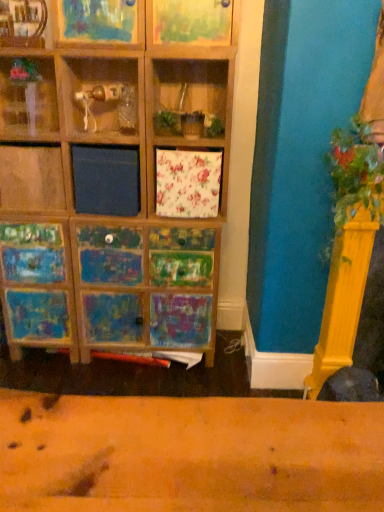
What do you see at coordinates (28, 98) in the screenshot? This screenshot has width=384, height=512. I see `clear glass vase at upper left, the first shelf viewed from the left` at bounding box center [28, 98].

Based on the photo, how much space does clear glass vase at upper left, arranged as the third shelf when viewed from the right, occupy vertically?

The height of clear glass vase at upper left, arranged as the third shelf when viewed from the right, is 13.66 inches.

Measure the distance between wooden shelf at upper left, arranged as the second shelf when viewed from the right, and camera.

wooden shelf at upper left, arranged as the second shelf when viewed from the right, and camera are 6.30 feet apart.

Describe the element at coordinates (354, 177) in the screenshot. The width and height of the screenshot is (384, 512). I see `green leafy plant at right` at that location.

In order to click on green leafy plant at right in this screenshot , I will do `click(354, 177)`.

Find the location of a particular element. The height and width of the screenshot is (512, 384). clear glass vase at upper left, the first shelf viewed from the left is located at coordinates (28, 98).

From a real-world perspective, is green leafy plant at right positioned under wooden shelf at upper left, arranged as the second shelf when viewed from the right, based on gravity?

Yes, from a real-world perspective, green leafy plant at right is below wooden shelf at upper left, arranged as the second shelf when viewed from the right.

Which of these two, green leafy plant at right or wooden shelf at upper left, arranged as the second shelf when viewed from the right, stands shorter?

wooden shelf at upper left, arranged as the second shelf when viewed from the right, is shorter.

Between green leafy plant at right and wooden shelf at upper left, arranged as the second shelf when viewed from the right, which one has smaller width?

With smaller width is wooden shelf at upper left, arranged as the second shelf when viewed from the right.

From the image's perspective, is green leafy plant at right over clear glass vase at upper left, the first shelf viewed from the left?

No.

How many degrees apart are the facing directions of green leafy plant at right and clear glass vase at upper left, the first shelf viewed from the left?

green leafy plant at right and clear glass vase at upper left, the first shelf viewed from the left, are facing 4.82 degrees away from each other.

From their relative heights in the image, would you say green leafy plant at right is taller or shorter than clear glass vase at upper left, arranged as the third shelf when viewed from the right?

green leafy plant at right is taller than clear glass vase at upper left, arranged as the third shelf when viewed from the right.

Which shelf is the 1st one when counting from the left side of the wooden frame at upper center, arranged as the first shelf when viewed from the right? Please provide its 2D coordinates.

[(23, 23)]

Consider the image. Is wooden frame at upper center, arranged as the first shelf when viewed from the right, inside wooden shelf at upper left, positioned as the second shelf in left-to-right order?

Definitely not — wooden frame at upper center, arranged as the first shelf when viewed from the right, is not inside wooden shelf at upper left, positioned as the second shelf in left-to-right order.

From a real-world perspective, between wooden shelf at upper left, positioned as the second shelf in left-to-right order, and wooden frame at upper center, which is the third shelf in left-to-right order, who is vertically higher?

wooden frame at upper center, which is the third shelf in left-to-right order, is physically above.

Is point (14, 19) in front of point (107, 22)?

No, (14, 19) is further to viewer.

Can you tell me how much clear glass vase at upper left, arranged as the third shelf when viewed from the right, and green leafy plant at right differ in facing direction?

The angular difference between clear glass vase at upper left, arranged as the third shelf when viewed from the right, and green leafy plant at right is 4.82 degrees.

Which point is more forward, [16,65] or [350,173]?

Positioned in front is point [350,173].

Based on the photo, is clear glass vase at upper left, arranged as the third shelf when viewed from the right, inside or outside of green leafy plant at right?

clear glass vase at upper left, arranged as the third shelf when viewed from the right, is located beyond the bounds of green leafy plant at right.

From a real-world perspective, which is physically below, clear glass vase at upper left, the first shelf viewed from the left, or green leafy plant at right?

In real-world perspective, green leafy plant at right is lower.

How far apart are wooden frame at upper center, arranged as the first shelf when viewed from the right, and clear glass vase at upper left, the first shelf viewed from the left?

wooden frame at upper center, arranged as the first shelf when viewed from the right, and clear glass vase at upper left, the first shelf viewed from the left, are 14.05 inches apart.

From the image's perspective, which object appears higher, wooden frame at upper center, which is the third shelf in left-to-right order, or clear glass vase at upper left, arranged as the third shelf when viewed from the right?

wooden frame at upper center, which is the third shelf in left-to-right order, appears higher in the image.

In the image, is wooden frame at upper center, arranged as the first shelf when viewed from the right, on the left side or the right side of clear glass vase at upper left, the first shelf viewed from the left?

From the image, it's evident that wooden frame at upper center, arranged as the first shelf when viewed from the right, is to the right of clear glass vase at upper left, the first shelf viewed from the left.

From a real-world perspective, does wooden frame at upper center, which is the third shelf in left-to-right order, sit lower than clear glass vase at upper left, arranged as the third shelf when viewed from the right?

Actually, wooden frame at upper center, which is the third shelf in left-to-right order, is physically above clear glass vase at upper left, arranged as the third shelf when viewed from the right, in the real world.

Can you confirm if wooden frame at upper center, which is the third shelf in left-to-right order, is positioned to the left of green leafy plant at right?

Yes, wooden frame at upper center, which is the third shelf in left-to-right order, is to the left of green leafy plant at right.

Which of these two, wooden frame at upper center, which is the third shelf in left-to-right order, or green leafy plant at right, stands shorter?

wooden frame at upper center, which is the third shelf in left-to-right order.

From a real-world perspective, is wooden frame at upper center, which is the third shelf in left-to-right order, below green leafy plant at right?

Incorrect, from a real-world perspective, wooden frame at upper center, which is the third shelf in left-to-right order, is higher than green leafy plant at right.

From the image's perspective, between wooden frame at upper center, which is the third shelf in left-to-right order, and green leafy plant at right, which one is located above?

From the image's view, wooden frame at upper center, which is the third shelf in left-to-right order, is above.

Considering the points (34, 39) and (335, 195), which point is in front, point (34, 39) or point (335, 195)?

Point (335, 195)

Does wooden shelf at upper left, positioned as the second shelf in left-to-right order, have a lesser height compared to green leafy plant at right?

Correct, wooden shelf at upper left, positioned as the second shelf in left-to-right order, is not as tall as green leafy plant at right.

From the green leafy plant at right, count 2nd shelfs backward and point to it. Please provide its 2D coordinates.

[(23, 23)]

Is wooden shelf at upper left, positioned as the second shelf in left-to-right order, inside the boundaries of green leafy plant at right, or outside?

wooden shelf at upper left, positioned as the second shelf in left-to-right order, cannot be found inside green leafy plant at right.

Identify the location of plant located underneath the wooden shelf at upper left, arranged as the second shelf when viewed from the right (from a real-world perspective). Image resolution: width=384 pixels, height=512 pixels. (354, 177).

Image resolution: width=384 pixels, height=512 pixels. Identify the location of plant on the right of the clear glass vase at upper left, arranged as the third shelf when viewed from the right. (354, 177).

Considering their positions, is wooden shelf at upper left, arranged as the second shelf when viewed from the right, positioned further to green leafy plant at right than clear glass vase at upper left, the first shelf viewed from the left?

Among the two, wooden shelf at upper left, arranged as the second shelf when viewed from the right, is located further to green leafy plant at right.

Which object lies nearer to the anchor point wooden shelf at upper left, positioned as the second shelf in left-to-right order, wooden frame at upper center, which is the third shelf in left-to-right order, or clear glass vase at upper left, the first shelf viewed from the left?

The object closer to wooden shelf at upper left, positioned as the second shelf in left-to-right order, is wooden frame at upper center, which is the third shelf in left-to-right order.

Looking at this image, which object lies nearer to the anchor point wooden frame at upper center, which is the third shelf in left-to-right order, clear glass vase at upper left, arranged as the third shelf when viewed from the right, or wooden shelf at upper left, arranged as the second shelf when viewed from the right?

wooden shelf at upper left, arranged as the second shelf when viewed from the right.

Based on the photo, looking at the image, which one is located closer to wooden frame at upper center, which is the third shelf in left-to-right order, green leafy plant at right or wooden shelf at upper left, arranged as the second shelf when viewed from the right?

wooden shelf at upper left, arranged as the second shelf when viewed from the right, is closer to wooden frame at upper center, which is the third shelf in left-to-right order.

When comparing their distances from green leafy plant at right, does wooden frame at upper center, which is the third shelf in left-to-right order, or wooden shelf at upper left, positioned as the second shelf in left-to-right order, seem further?

The object further to green leafy plant at right is wooden shelf at upper left, positioned as the second shelf in left-to-right order.

Looking at the image, which one is located closer to wooden shelf at upper left, arranged as the second shelf when viewed from the right, green leafy plant at right or wooden frame at upper center, arranged as the first shelf when viewed from the right?

wooden frame at upper center, arranged as the first shelf when viewed from the right.

When comparing their distances from green leafy plant at right, does wooden frame at upper center, arranged as the first shelf when viewed from the right, or clear glass vase at upper left, the first shelf viewed from the left, seem further?

Among the two, clear glass vase at upper left, the first shelf viewed from the left, is located further to green leafy plant at right.

Based on their spatial positions, is clear glass vase at upper left, the first shelf viewed from the left, or green leafy plant at right closer to wooden frame at upper center, which is the third shelf in left-to-right order?

Among the two, clear glass vase at upper left, the first shelf viewed from the left, is located nearer to wooden frame at upper center, which is the third shelf in left-to-right order.

In order to click on shelf between clear glass vase at upper left, the first shelf viewed from the left, and wooden frame at upper center, which is the third shelf in left-to-right order, from left to right in this screenshot , I will do `click(23, 23)`.

The height and width of the screenshot is (512, 384). I want to click on shelf between wooden shelf at upper left, positioned as the second shelf in left-to-right order, and green leafy plant at right, in the horizontal direction, so click(100, 22).